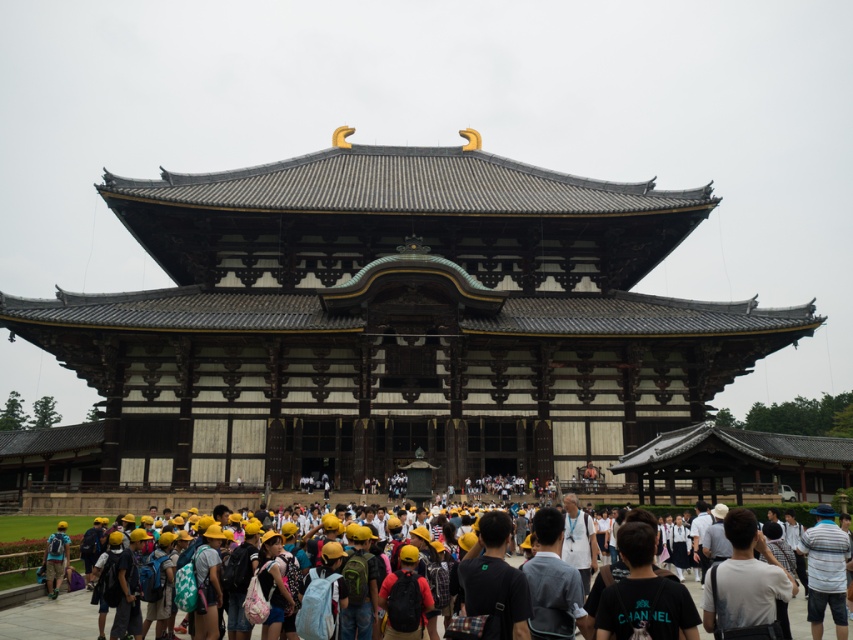
You are a photographer standing in front of the dark brown wooden temple at center and the white cotton shirt at center. You want to take a picture that includes both objects. Which one should you focus on to ensure both are in frame?

Since the dark brown wooden temple at center is bigger than the white cotton shirt at center, you should focus on the dark brown wooden temple at center to ensure both are in frame as it takes up more space.

You are standing in front of the dark brown wooden temple at center and the white cotton shirt at center. Which object is closer to you?

The dark brown wooden temple at center is closer to you than the white cotton shirt at center because it is further to the viewer.